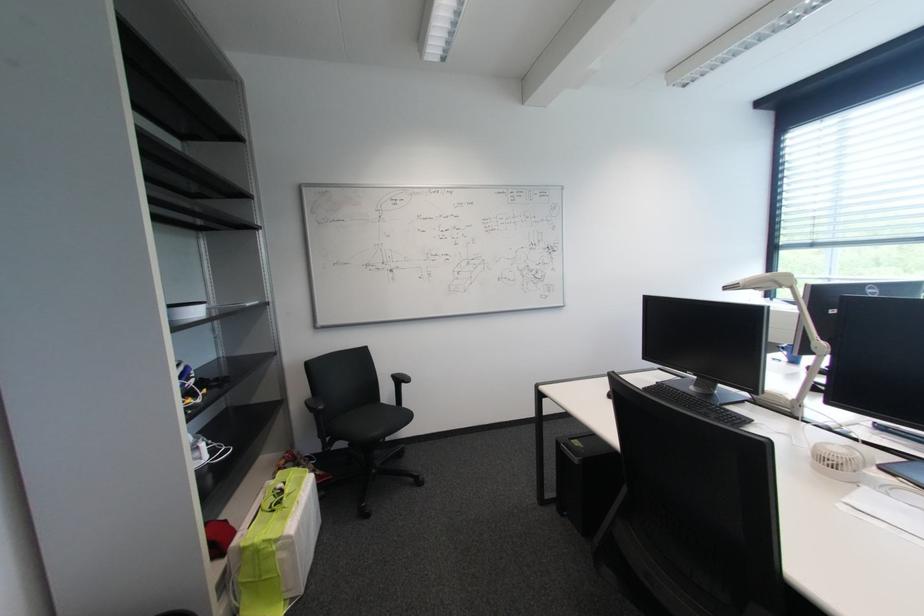
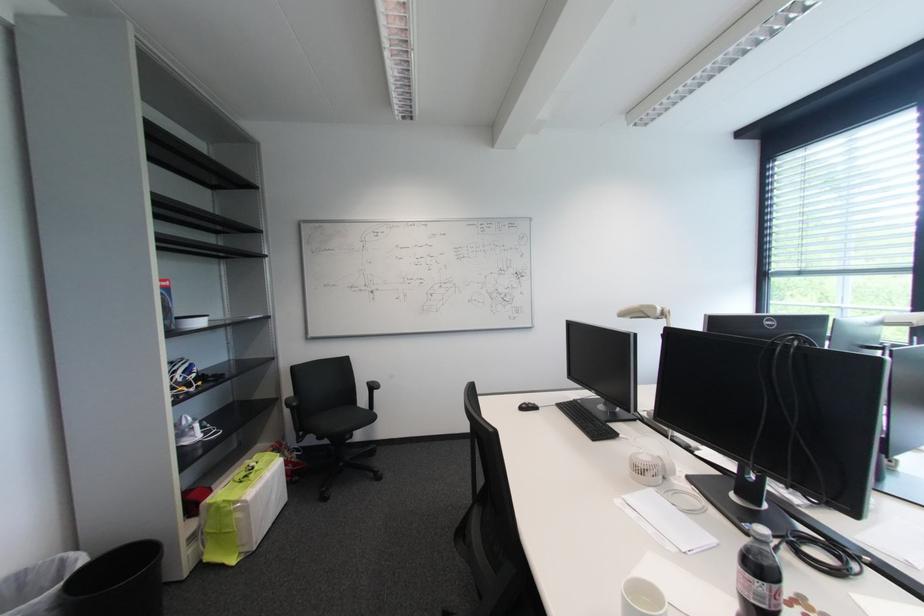
Which direction would the cameraman need to move to produce the second image?

The cameraman moved toward right, backward.